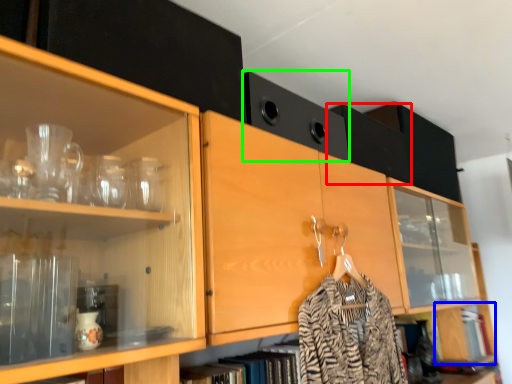
Question: Which object is positioned closest to cabinetry (highlighted by a red box)? Select from cabinetry (highlighted by a blue box) and cabinetry (highlighted by a green box).

Choices:
 (A) cabinetry
 (B) cabinetry

Answer: (B)